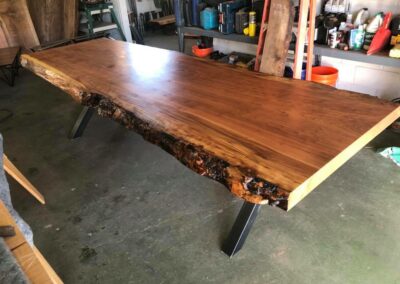
Where is `wood beams`? wood beams is located at coordinates pyautogui.click(x=303, y=33), pyautogui.click(x=312, y=38).